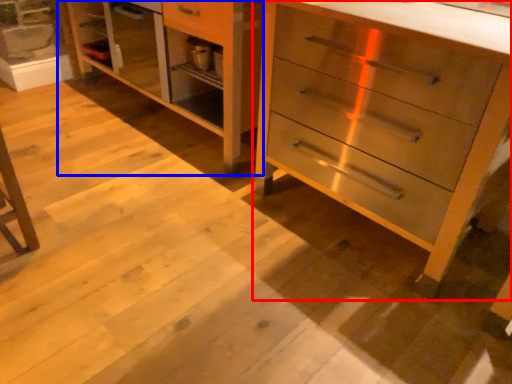
Question: Among these objects, which one is nearest to the camera, chest of drawers (highlighted by a red box) or dresser (highlighted by a blue box)?

Choices:
 (A) chest of drawers
 (B) dresser

Answer: (A)